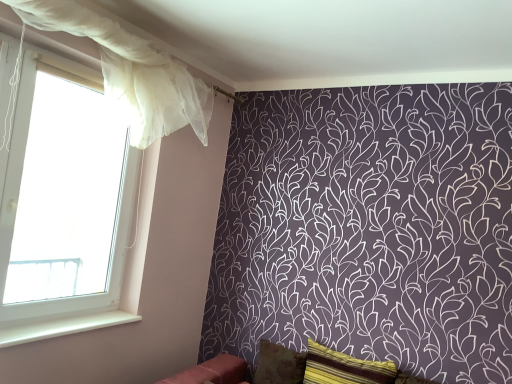
Question: In terms of width, does white smooth window sill at lower left look wider or thinner when compared to white sheer curtain at left?

Choices:
 (A) wide
 (B) thin

Answer: (A)

Question: In terms of height, does white smooth window sill at lower left look taller or shorter compared to white sheer curtain at left?

Choices:
 (A) short
 (B) tall

Answer: (A)

Question: Which object is the farthest from the white sheer curtain at left?

Choices:
 (A) brown textured pillow at lower center, the first pillow viewed from the back
 (B) translucent white curtain at left
 (C) white smooth window sill at lower left
 (D) striped fabric pillow at lower right, marked as the first pillow in a front-to-back arrangement
 (E) velvet red sofa at lower center

Answer: (D)

Question: Which object is positioned farthest from the translucent white curtain at left?

Choices:
 (A) brown textured pillow at lower center, which is the 2th pillow from front to back
 (B) white smooth window sill at lower left
 (C) velvet red sofa at lower center
 (D) white sheer curtain at left
 (E) striped fabric pillow at lower right, placed as the second pillow when sorted from back to front

Answer: (E)